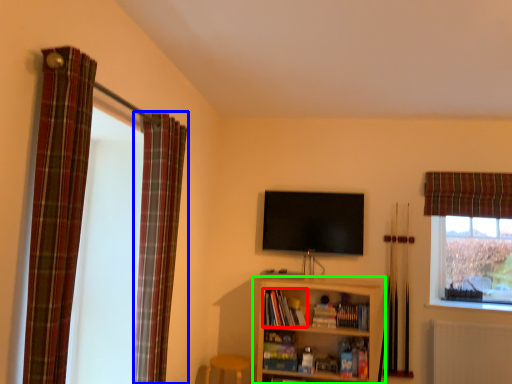
Question: Which object is positioned farthest from book (highlighted by a red box)? Select from curtain (highlighted by a blue box) and shelf (highlighted by a green box).

Choices:
 (A) curtain
 (B) shelf

Answer: (A)